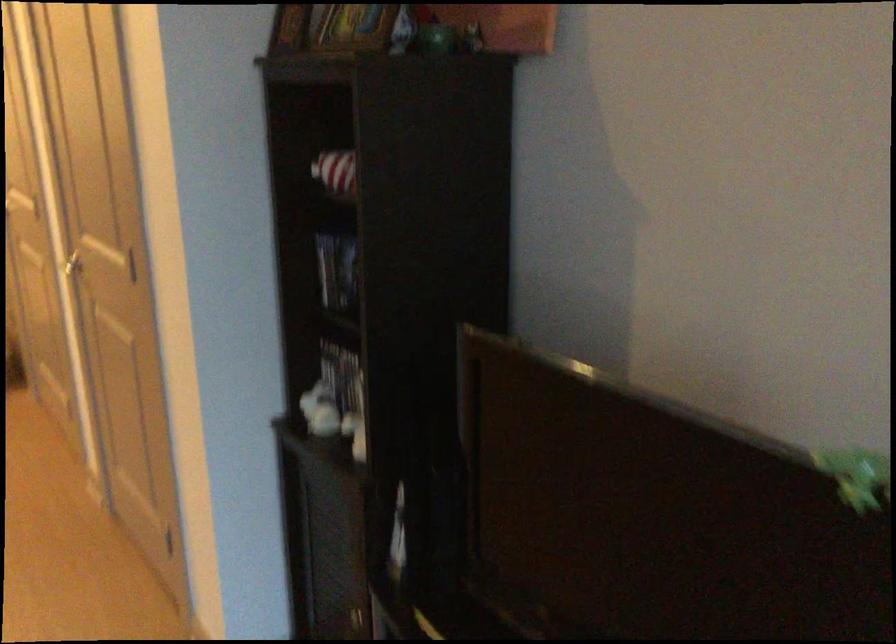
You are a GUI agent. You are given a task and a screenshot of the screen. Output one action in this format:
    pyautogui.click(x=<x>, y=<y>)
    Task: Click on the green frog toy
    The image size is (896, 644).
    Given the screenshot: What is the action you would take?
    pyautogui.click(x=857, y=476)